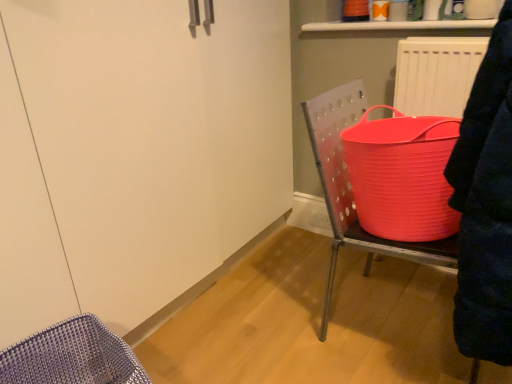
Identify the location of vacant space underneath rubberized plastic bucket at right (from a real-world perspective). The image size is (512, 384). coord(398,324).